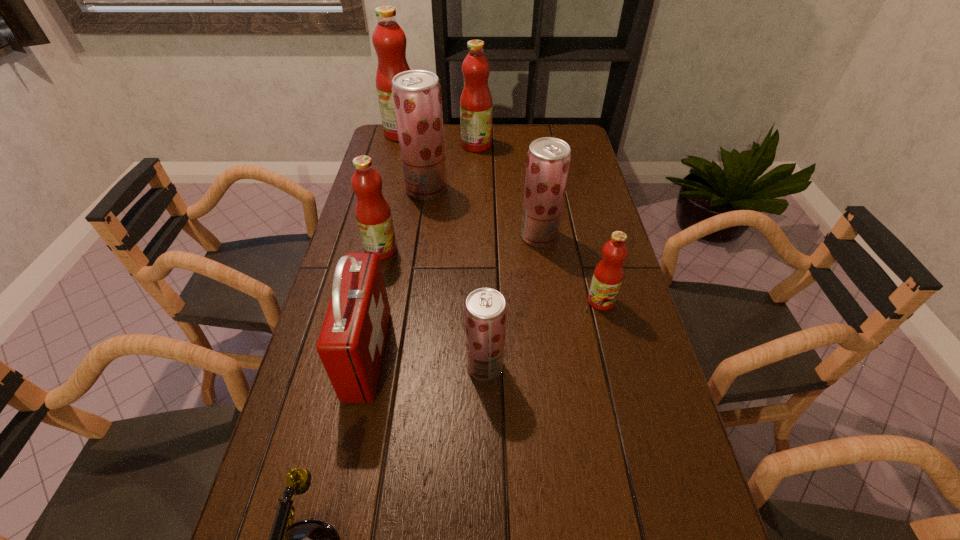
Locate an element on the screen. The width and height of the screenshot is (960, 540). free space located on the left of the nearest strawberry fruit juice is located at coordinates (319, 366).

The height and width of the screenshot is (540, 960). Find the location of `the first-aid kit at the left edge`. the first-aid kit at the left edge is located at coordinates (351, 342).

What are the coordinates of `object located in the right edge section of the desktop` in the screenshot? It's located at (608, 274).

In order to click on object that is at the far left corner in this screenshot , I will do `click(389, 40)`.

Locate an element on the screen. The image size is (960, 540). free region at the far edge of the desktop is located at coordinates point(506,132).

Image resolution: width=960 pixels, height=540 pixels. What are the coordinates of `vacant space at the left edge of the desktop` in the screenshot? It's located at (300, 393).

You are a GUI agent. You are given a task and a screenshot of the screen. Output one action in this format:
    pyautogui.click(x=<x>, y=<y>)
    Task: Click on the free region at the right edge of the desktop
    
    Given the screenshot: What is the action you would take?
    pyautogui.click(x=634, y=419)

Locate an element on the screen. The height and width of the screenshot is (540, 960). free space between the eighth object from left to right and the second smallest pink fruit juice is located at coordinates (460, 243).

At what (x,y) coordinates should I click in order to perform the action: click on vacant space that's between the third smallest pink fruit juice and the red first-aid kit. Please return your answer as a coordinate pair (x, y). Image resolution: width=960 pixels, height=540 pixels. Looking at the image, I should click on click(x=422, y=250).

Image resolution: width=960 pixels, height=540 pixels. I want to click on vacant space that is in between the third farthest object and the second nearest pink fruit juice, so click(x=404, y=219).